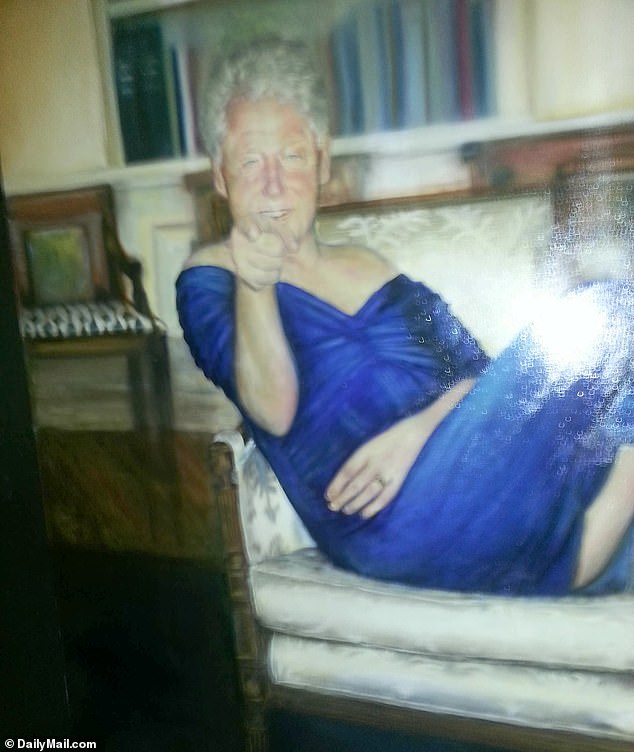
Locate an element on the screen. Image resolution: width=634 pixels, height=752 pixels. portrait is located at coordinates (515, 76).